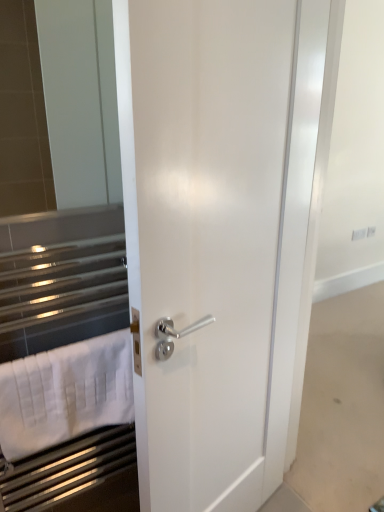
Identify the location of empty space that is ontop of white cotton bath towel at left (from a real-world perspective). (54, 354).